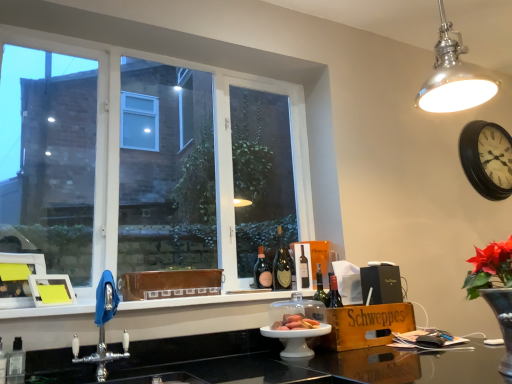
At what (x,y) coordinates should I click in order to perform the action: click on wooden box at lower right. Please return your answer as a coordinate pair (x, y). This screenshot has height=384, width=512. Looking at the image, I should click on (365, 325).

The height and width of the screenshot is (384, 512). Identify the location of black wooden clock at upper right. (487, 159).

Visually, is matte glass bottle at center, the 2th bottle positioned from the right, positioned to the left or to the right of polished metal light fixture at upper right?

Clearly, matte glass bottle at center, the 2th bottle positioned from the right, is on the left of polished metal light fixture at upper right in the image.

From a real-world perspective, which is physically above, matte glass bottle at center, the 2th bottle positioned from the right, or polished metal light fixture at upper right?

polished metal light fixture at upper right.

Are matte glass bottle at center, the 2th bottle positioned from the right, and polished metal light fixture at upper right far apart?

Yes.

From a real-world perspective, is white plastic window at left under white glossy window sill at lower center?

No, from a real-world perspective, white plastic window at left is not below white glossy window sill at lower center.

Is white plastic window at left positioned with its back to white glossy window sill at lower center?

No, white plastic window at left is not facing the opposite direction of white glossy window sill at lower center.

The image size is (512, 384). What are the coordinates of `window behind the white glossy window sill at lower center` in the screenshot? It's located at (220, 72).

Find the location of a particular element. The image size is (512, 384). light fixture in front of the white plastic window at left is located at coordinates (454, 76).

Is polished metal light fixture at upper right with white plastic window at left?

No.

Which is in front, polished metal light fixture at upper right or white plastic window at left?

polished metal light fixture at upper right is more forward.

Which object is more forward, matte brown bread at center or polished metal light fixture at upper right?

polished metal light fixture at upper right is closer to the camera.

How much distance is there between matte brown bread at center and polished metal light fixture at upper right?

They are 1.14 meters apart.

Is matte brown bread at center facing away from polished metal light fixture at upper right?

That's not correct — matte brown bread at center is not looking away from polished metal light fixture at upper right.

Between matte brown bread at center and polished metal light fixture at upper right, which one appears on the left side from the viewer's perspective?

From the viewer's perspective, matte brown bread at center appears more on the left side.

Considering the points (364, 343) and (261, 247), which point is behind, point (364, 343) or point (261, 247)?

The point (261, 247) is more distant.

Is wooden box at lower right looking in the opposite direction of matte glass bottle at center, the 1th bottle in the left-to-right sequence?

No, matte glass bottle at center, the 1th bottle in the left-to-right sequence, is not at the back of wooden box at lower right.

From a real-world perspective, is wooden box at lower right on top of matte glass bottle at center, the 1th bottle in the left-to-right sequence?

Incorrect, from a real-world perspective, wooden box at lower right is lower than matte glass bottle at center, the 1th bottle in the left-to-right sequence.

Is wooden box at lower right thinner than matte glass bottle at center, the 1th bottle in the left-to-right sequence?

No, wooden box at lower right is not thinner than matte glass bottle at center, the 1th bottle in the left-to-right sequence.

Between wooden box at lower right and chrome metallic tap at lower left, which one has smaller width?

Thinner between the two is chrome metallic tap at lower left.

Considering the positions of point (329, 348) and point (100, 340), is point (329, 348) closer or farther from the camera than point (100, 340)?

Point (329, 348) appears to be farther away from the viewer than point (100, 340).

In order to click on box below the chrome metallic tap at lower left (from a real-world perspective) in this screenshot , I will do [x=365, y=325].

Are shiny gold bottle at center, placed as the second bottle when sorted from left to right, and white glossy window sill at lower center beside each other?

There is a gap between shiny gold bottle at center, placed as the second bottle when sorted from left to right, and white glossy window sill at lower center.

How many degrees apart are the facing directions of shiny gold bottle at center, placed as the second bottle when sorted from left to right, and white glossy window sill at lower center?

There is a 0.0015-degree angle between the facing directions of shiny gold bottle at center, placed as the second bottle when sorted from left to right, and white glossy window sill at lower center.

Which is correct: shiny gold bottle at center, the 1th bottle when ordered from right to left, is inside white glossy window sill at lower center, or outside of it?

shiny gold bottle at center, the 1th bottle when ordered from right to left, cannot be found inside white glossy window sill at lower center.

Relative to white glossy window sill at lower center, is shiny gold bottle at center, placed as the second bottle when sorted from left to right, in front or behind?

shiny gold bottle at center, placed as the second bottle when sorted from left to right, is behind white glossy window sill at lower center.

At what (x,y) coordinates should I click in order to perform the action: click on light fixture in front of the matte glass bottle at center, the 1th bottle in the left-to-right sequence. Please return your answer as a coordinate pair (x, y). The width and height of the screenshot is (512, 384). Looking at the image, I should click on (454, 76).

The width and height of the screenshot is (512, 384). I want to click on window sill below the white plastic window at left (from the image's perspective), so click(x=205, y=301).

Estimate the real-world distances between objects in this image. Which object is closer to white plastic window at left, black wooden clock at upper right or white glossy window sill at lower center?

The object closer to white plastic window at left is white glossy window sill at lower center.

Which object lies further to the anchor point polished metal light fixture at upper right, black wooden clock at upper right or white glossy window sill at lower center?

white glossy window sill at lower center is positioned further to the anchor polished metal light fixture at upper right.

When comparing their distances from wooden box at lower right, does shiny gold bottle at center, the 1th bottle when ordered from right to left, or black wooden clock at upper right seem closer?

shiny gold bottle at center, the 1th bottle when ordered from right to left, is closer to wooden box at lower right.

Estimate the real-world distances between objects in this image. Which object is further from matte glass bottle at center, the 2th bottle positioned from the right, chrome metallic tap at lower left or shiny gold bottle at center, placed as the second bottle when sorted from left to right?

chrome metallic tap at lower left lies further to matte glass bottle at center, the 2th bottle positioned from the right, than the other object.

From the image, which object appears to be nearer to white glossy window sill at lower center, matte glass bottle at center, the 2th bottle positioned from the right, or black wooden clock at upper right?

Among the two, matte glass bottle at center, the 2th bottle positioned from the right, is located nearer to white glossy window sill at lower center.

Which object lies further to the anchor point wooden box at lower right, white glossy window sill at lower center or polished metal light fixture at upper right?

Based on the image, polished metal light fixture at upper right appears to be further to wooden box at lower right.

Considering their positions, is wooden box at lower right positioned further to matte brown bread at center than polished metal light fixture at upper right?

polished metal light fixture at upper right is further to matte brown bread at center.

From the image, which object appears to be farther from matte brown bread at center, shiny gold bottle at center, placed as the second bottle when sorted from left to right, or black wooden clock at upper right?

black wooden clock at upper right is positioned further to the anchor matte brown bread at center.

Locate an element on the screen. The image size is (512, 384). window sill between white plastic window at left and polished metal light fixture at upper right in the horizontal direction is located at coordinates (205, 301).

Where is `window sill located between white plastic window at left and black wooden clock at upper right in the left-right direction`? This screenshot has height=384, width=512. window sill located between white plastic window at left and black wooden clock at upper right in the left-right direction is located at coordinates (205, 301).

You are a GUI agent. You are given a task and a screenshot of the screen. Output one action in this format:
    pyautogui.click(x=<x>, y=<y>)
    Task: Click on the box between matte brown bread at center and shiny gold bottle at center, placed as the second bottle when sorted from left to right, in the front-back direction
    The height and width of the screenshot is (384, 512).
    Given the screenshot: What is the action you would take?
    pyautogui.click(x=365, y=325)

Where is `box between matte brown bread at center and black wooden clock at upper right`? The image size is (512, 384). box between matte brown bread at center and black wooden clock at upper right is located at coordinates (365, 325).